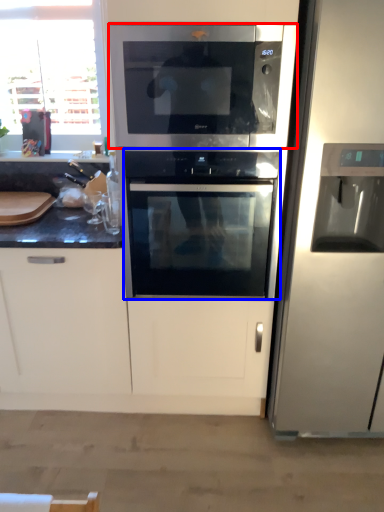
Question: Which of the following is the farthest to the observer, microwave oven (highlighted by a red box) or oven (highlighted by a blue box)?

Choices:
 (A) microwave oven
 (B) oven

Answer: (B)